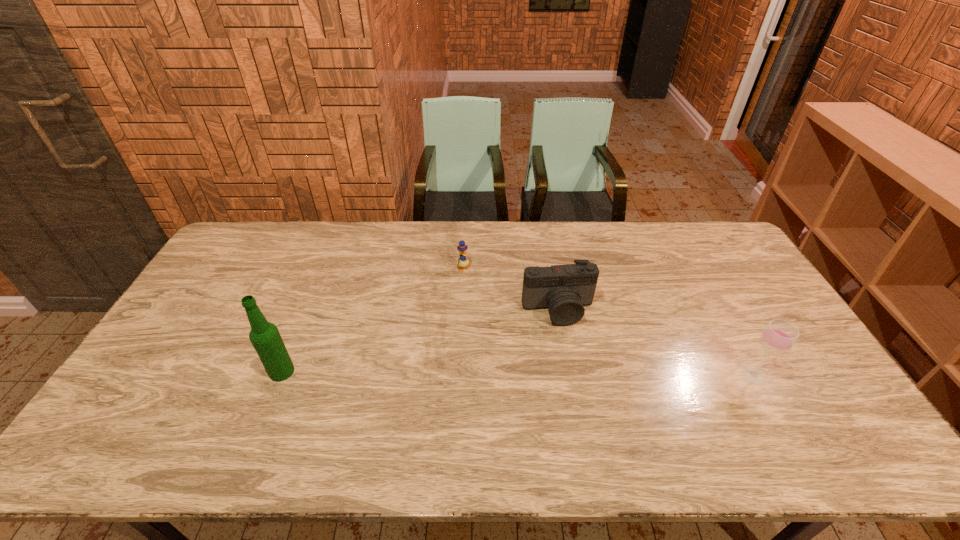
At what (x,y) coordinates should I click in order to perform the action: click on vacant point located on the label of the beer bottle. Please return your answer as a coordinate pair (x, y). Image resolution: width=960 pixels, height=540 pixels. Looking at the image, I should click on (175, 372).

Locate an element on the screen. Image resolution: width=960 pixels, height=540 pixels. vacant space located 0.150m on the right of the third shortest object is located at coordinates (823, 375).

The height and width of the screenshot is (540, 960). In order to click on vacant point located on the face of the duckling, where the monocle is placed in this screenshot , I will do `click(525, 324)`.

Identify the location of free space located on the face of the duckling, where the monocle is placed. This screenshot has height=540, width=960. (543, 341).

You are a GUI agent. You are given a task and a screenshot of the screen. Output one action in this format:
    pyautogui.click(x=<x>, y=<y>)
    Task: Click on the vacant space located on the face of the duckling, where the monocle is placed
    This screenshot has height=540, width=960.
    Given the screenshot: What is the action you would take?
    pyautogui.click(x=494, y=296)

Where is `vacant area situated at the lens of the second object from right to left`? This screenshot has width=960, height=540. vacant area situated at the lens of the second object from right to left is located at coordinates (588, 397).

Find the location of `free space located 0.230m at the lens of the second object from right to left`. free space located 0.230m at the lens of the second object from right to left is located at coordinates (586, 394).

You are a GUI agent. You are given a task and a screenshot of the screen. Output one action in this format:
    pyautogui.click(x=<x>, y=<y>)
    Task: Click on the vacant space located 0.150m at the lens of the second object from right to left
    
    Given the screenshot: What is the action you would take?
    pyautogui.click(x=578, y=368)

Locate an element on the screen. object present at the right edge is located at coordinates (778, 337).

Identify the location of vacant region at the far edge of the desktop. Image resolution: width=960 pixels, height=540 pixels. (469, 259).